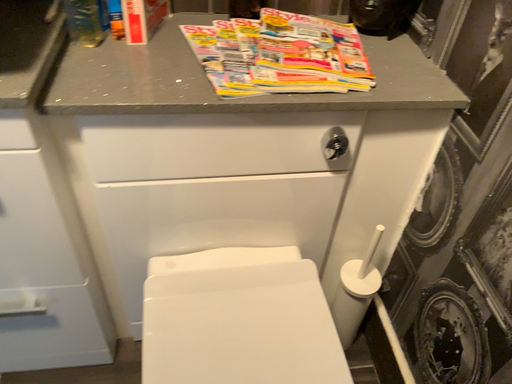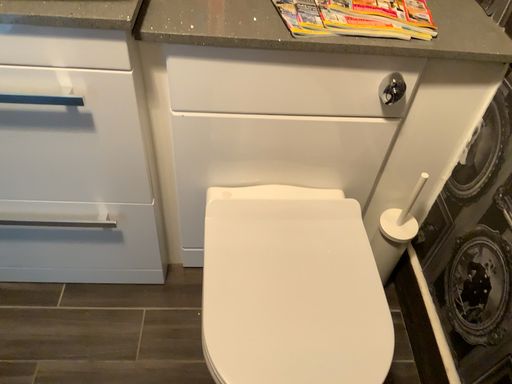
Question: How did the camera likely rotate when shooting the video?

Choices:
 (A) rotated left
 (B) rotated right

Answer: (A)